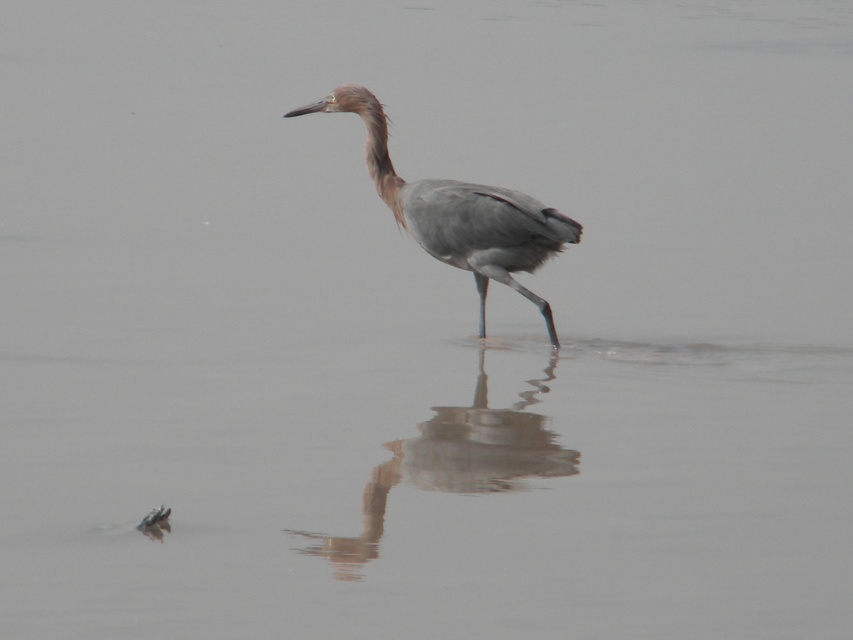
Does gray matte heron at center appear over smooth gray heron reflection at center?

Correct, gray matte heron at center is located above smooth gray heron reflection at center.

Is gray matte heron at center below smooth gray heron reflection at center?

Actually, gray matte heron at center is above smooth gray heron reflection at center.

The height and width of the screenshot is (640, 853). In order to click on gray matte heron at center in this screenshot , I will do `click(457, 211)`.